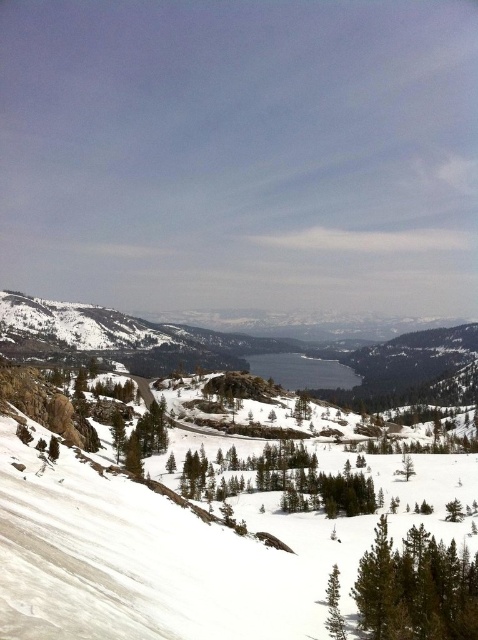
You are an outdoor photographer setting up a tripod in the winter landscape scene. You want to frame both the green matte tree at lower right and the green textured pine tree at lower center in your shot. Which tree should you position closer to the edge of the frame to maintain balance?

To maintain balance in the composition, position the green textured pine tree at lower center closer to the edge of the frame since it is smaller in size compared to the green matte tree at lower right.